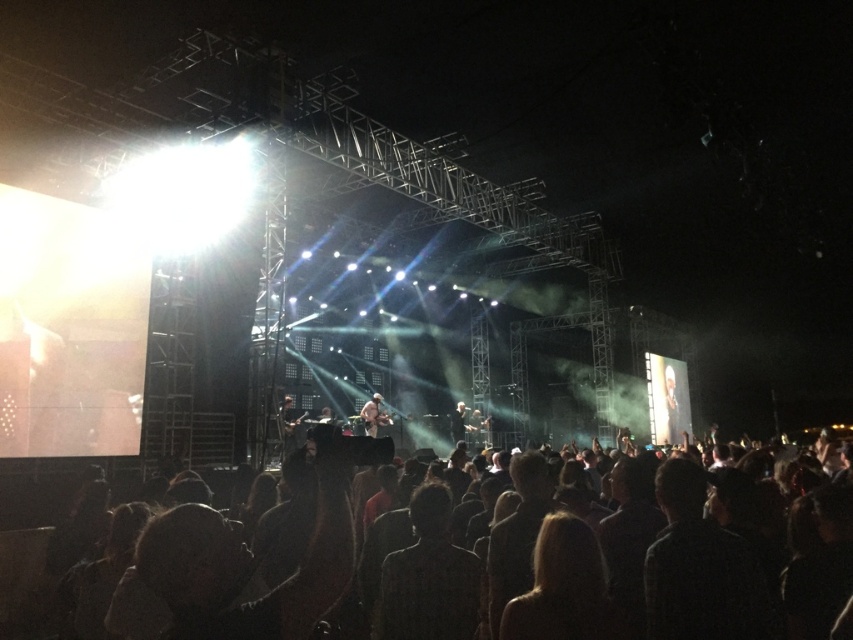
Question: Which object is positioned farthest from the dark hair at lower center?

Choices:
 (A) light brown leather jacket at center
 (B) blonde hair at center

Answer: (A)

Question: Where is dark hair at lower center located in relation to shiny silver guitar at center in the image?

Choices:
 (A) above
 (B) below

Answer: (A)

Question: Which of these objects is positioned closest to the smooth skin face at center?

Choices:
 (A) dark fabric head at lower right
 (B) light brown leather jacket at center
 (C) dark hair at lower center

Answer: (B)

Question: Can you confirm if smooth skin face at center is smaller than light brown leather jacket at center?

Choices:
 (A) no
 (B) yes

Answer: (B)

Question: From the image, what is the correct spatial relationship of blonde hair at center in relation to smooth skin face at center?

Choices:
 (A) above
 (B) below

Answer: (A)

Question: Which object appears closest to the camera in this image?

Choices:
 (A) dark fabric at center
 (B) dark hair at lower center
 (C) light brown leather jacket at center
 (D) dark fabric head at lower right

Answer: (B)